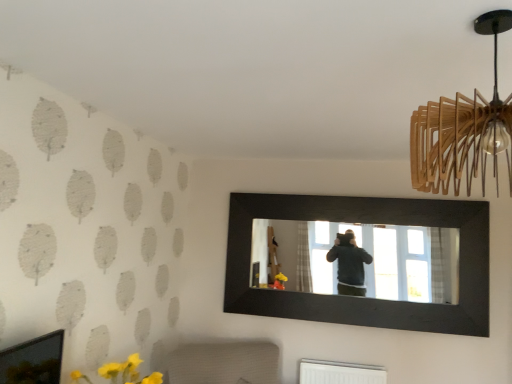
Question: From a real-world perspective, is wooden pendant light at upper right under black wooden mirror at center?

Choices:
 (A) yes
 (B) no

Answer: (B)

Question: From the image's perspective, does wooden pendant light at upper right appear higher than black wooden mirror at center?

Choices:
 (A) yes
 (B) no

Answer: (A)

Question: Is wooden pendant light at upper right facing away from black wooden mirror at center?

Choices:
 (A) no
 (B) yes

Answer: (A)

Question: Is wooden pendant light at upper right positioned far away from black wooden mirror at center?

Choices:
 (A) yes
 (B) no

Answer: (B)

Question: From a real-world perspective, does wooden pendant light at upper right stand above black wooden mirror at center?

Choices:
 (A) yes
 (B) no

Answer: (A)

Question: Considering the positions of white textured radiator at lower center and black wooden mirror at center in the image, is white textured radiator at lower center bigger or smaller than black wooden mirror at center?

Choices:
 (A) small
 (B) big

Answer: (B)

Question: From the image's perspective, relative to black wooden mirror at center, is white textured radiator at lower center above or below?

Choices:
 (A) below
 (B) above

Answer: (A)

Question: Looking at their shapes, would you say white textured radiator at lower center is wider or thinner than black wooden mirror at center?

Choices:
 (A) thin
 (B) wide

Answer: (B)

Question: Considering their positions, is white textured radiator at lower center located in front of or behind black wooden mirror at center?

Choices:
 (A) behind
 (B) front

Answer: (B)

Question: From a real-world perspective, is white textured radiator at lower center above or below wooden pendant light at upper right?

Choices:
 (A) above
 (B) below

Answer: (B)

Question: In terms of width, does white textured radiator at lower center look wider or thinner when compared to wooden pendant light at upper right?

Choices:
 (A) wide
 (B) thin

Answer: (A)

Question: In the image, is white textured radiator at lower center on the left side or the right side of wooden pendant light at upper right?

Choices:
 (A) left
 (B) right

Answer: (A)

Question: Considering their positions, is white textured radiator at lower center located in front of or behind wooden pendant light at upper right?

Choices:
 (A) behind
 (B) front

Answer: (A)

Question: Considering the positions of black wooden mirror at center and white textured radiator at lower center in the image, is black wooden mirror at center wider or thinner than white textured radiator at lower center?

Choices:
 (A) thin
 (B) wide

Answer: (A)

Question: Is black wooden mirror at center situated inside white textured radiator at lower center or outside?

Choices:
 (A) outside
 (B) inside

Answer: (A)